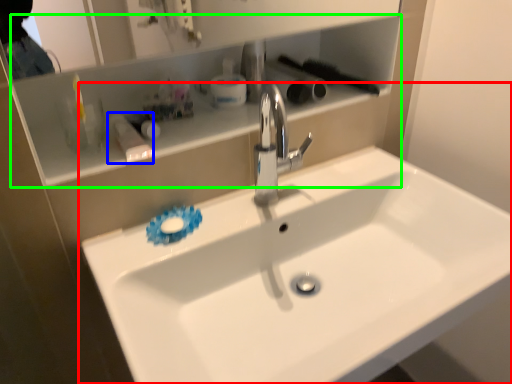
Question: Which object is the closest to the sink (highlighted by a red box)? Choose among these: toiletry (highlighted by a blue box) or cabinet (highlighted by a green box).

Choices:
 (A) toiletry
 (B) cabinet

Answer: (B)